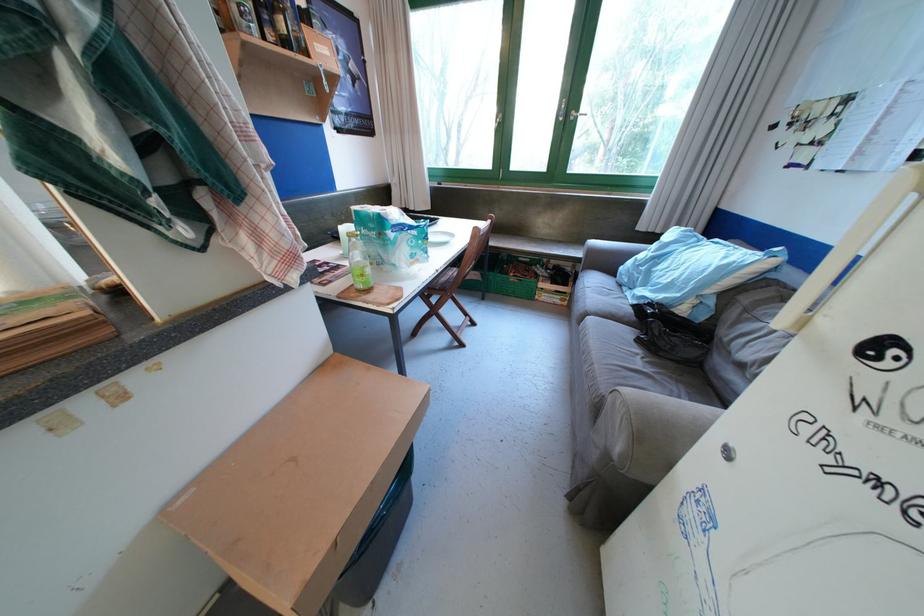
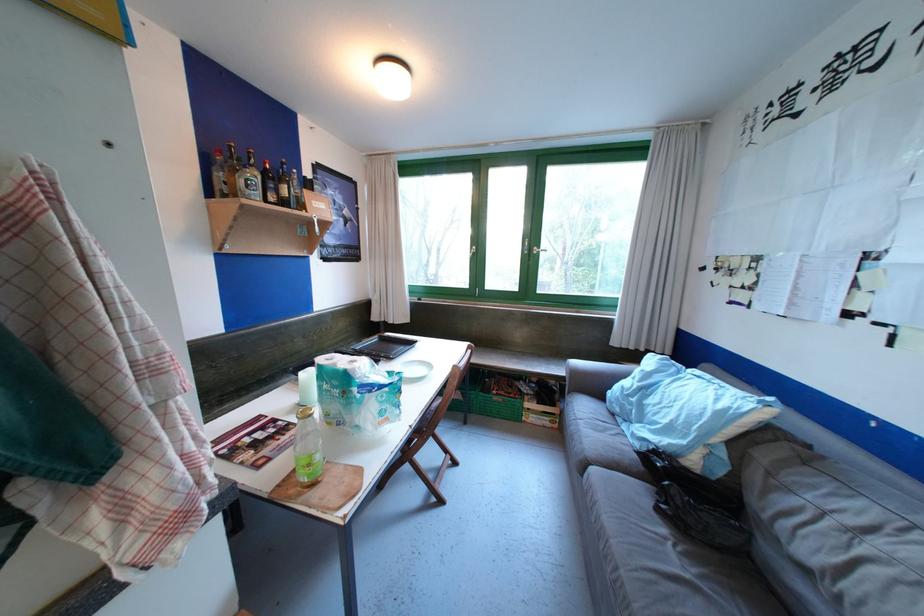
The point at (468,347) is marked in the first image. Where is the corresponding point in the second image?

(448, 504)